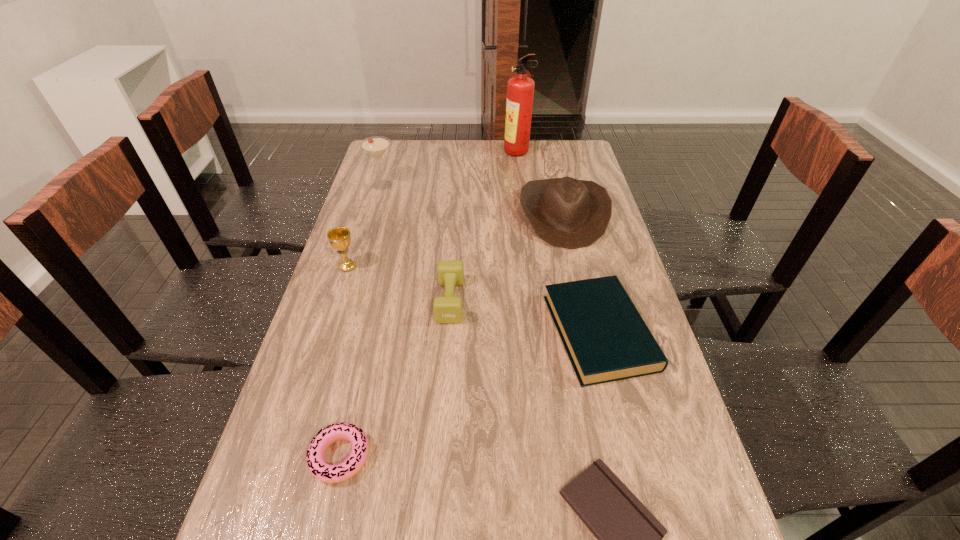
Where is `unoccupied area between the chalice and the cowboy hat`? The height and width of the screenshot is (540, 960). unoccupied area between the chalice and the cowboy hat is located at coordinates [456, 241].

Identify the location of empty space between the seventh shortest object and the chalice. The image size is (960, 540). (365, 226).

The height and width of the screenshot is (540, 960). Identify the location of vacant area that lies between the chalice and the doughnut. (344, 362).

Identify the location of vacant space that's between the fourth farthest object and the fire extinguisher. The width and height of the screenshot is (960, 540). (432, 210).

Locate an element on the screen. empty location between the farthest object and the fifth tallest object is located at coordinates (484, 227).

The height and width of the screenshot is (540, 960). I want to click on the sixth closest object to the dumbbell, so click(375, 146).

At what (x,y) coordinates should I click in order to perform the action: click on the sixth closest object relative to the fire extinguisher. Please return your answer as a coordinate pair (x, y). Looking at the image, I should click on click(352, 465).